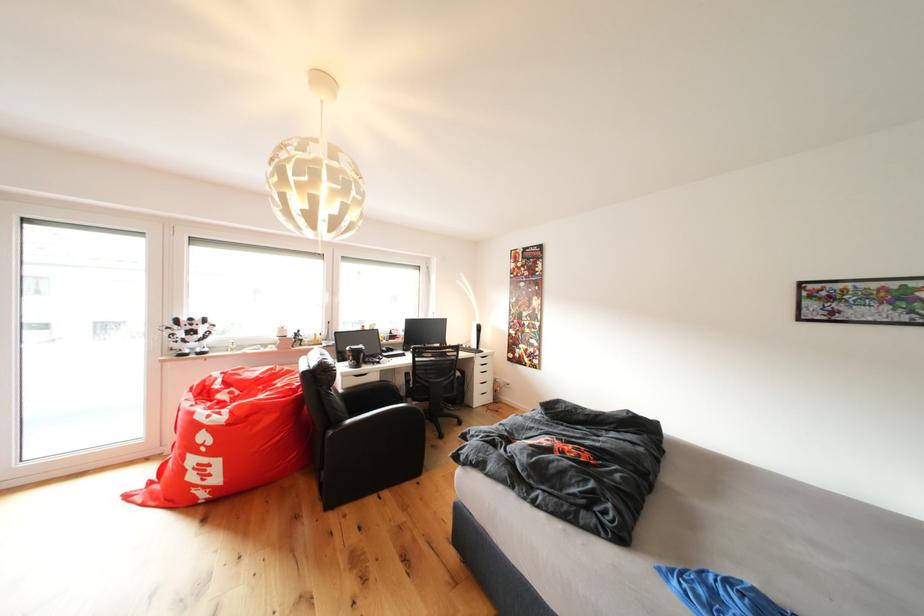
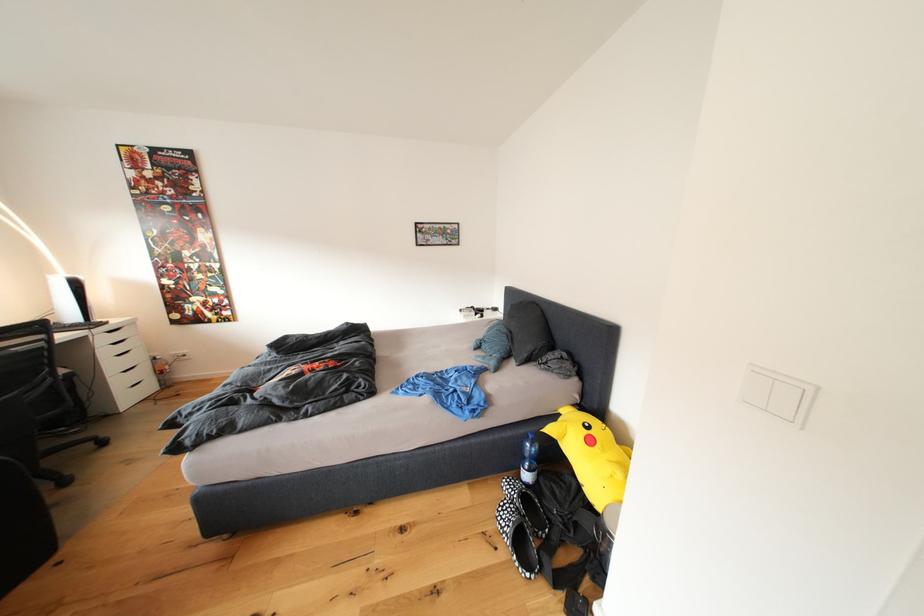
Where in the second image is the point corresponding to the point at 464,379 from the first image?

(63, 378)